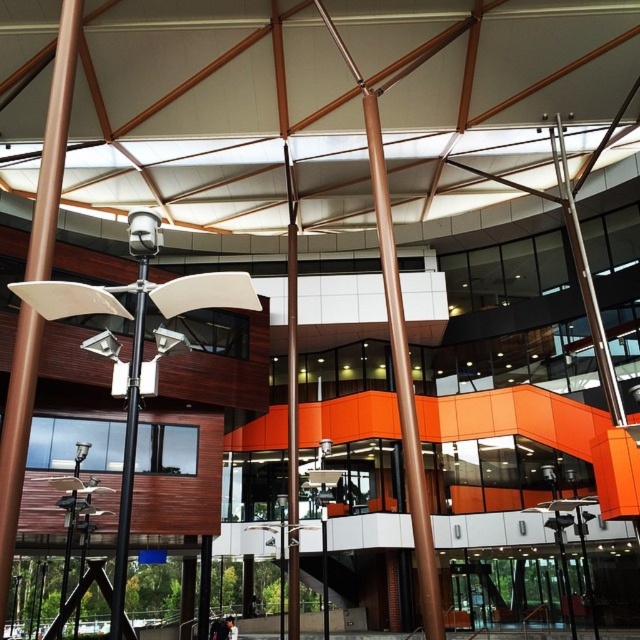
You are an architect evaluating the structural integrity of the building. You notice the brown polished metal pole at center and the polished silver pole at upper right. Which pole would require a stronger base to support its height?

The brown polished metal pole at center requires a stronger base because it is taller than the polished silver pole at upper right.